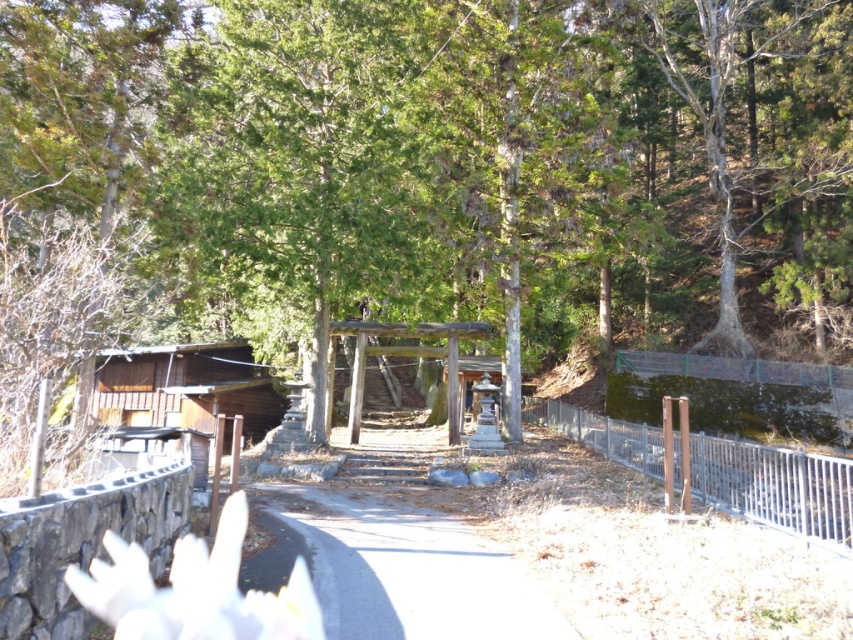
You are a hiker who wants to take shelter from the rain. You see a green leafy tree at center and a brown wooden cabin at left. Which one would provide better protection from the rain?

The brown wooden cabin at left would provide better protection from the rain because the green leafy tree at center is positioned over the brown wooden cabin at left, meaning the cabin is under the tree, but the cabin itself is a solid structure while the tree offers only partial cover.

You are standing at the entrance of the shrine and want to take a photo of the gray concrete path at center. Where should you position yourself to capture it in the frame?

You should position yourself at point [410,572] to capture the gray concrete path at center in the frame.

You are a visitor approaching the torii gate and notice the gray concrete path at center and the metallic silver fence at right. Which object is positioned to the left when facing the shrine entrance?

The gray concrete path at center is to the left of the metallic silver fence at right when facing the shrine entrance.